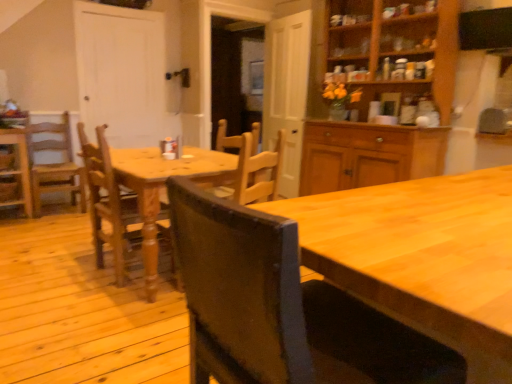
Question: Considering the relative sizes of wooden chair at center, placed as the third chair when sorted from left to right, and light brown wooden chair at left, acting as the 4th chair starting from the front, in the image provided, is wooden chair at center, placed as the third chair when sorted from left to right, thinner than light brown wooden chair at left, acting as the 4th chair starting from the front,?

Choices:
 (A) yes
 (B) no

Answer: (A)

Question: Does wooden chair at center, which ranks as the 3th chair in back-to-front order, appear on the left side of light brown wooden chair at left, arranged as the third chair when viewed from the right?

Choices:
 (A) yes
 (B) no

Answer: (B)

Question: From a real-world perspective, is wooden chair at center, which ranks as the 3th chair in back-to-front order, under light brown wooden chair at left, arranged as the third chair when viewed from the right?

Choices:
 (A) no
 (B) yes

Answer: (A)

Question: Is wooden chair at center, which appears as the second chair when viewed from the front, in front of light brown wooden chair at left, arranged as the third chair when viewed from the right?

Choices:
 (A) yes
 (B) no

Answer: (A)

Question: Is the surface of wooden chair at center, which appears as the 2th chair when viewed from the right, in direct contact with light brown wooden chair at left, acting as the 4th chair starting from the front?

Choices:
 (A) yes
 (B) no

Answer: (B)

Question: Is light brown wooden chair at left, arranged as the third chair when viewed from the right, spatially inside wooden chair at left, the fourth chair viewed from the right, or outside of it?

Choices:
 (A) inside
 (B) outside

Answer: (B)

Question: Looking at the image, does light brown wooden chair at left, placed as the second chair when sorted from left to right, seem bigger or smaller compared to wooden chair at left, the third chair in the front-to-back sequence?

Choices:
 (A) big
 (B) small

Answer: (A)

Question: In terms of width, does light brown wooden chair at left, acting as the 4th chair starting from the front, look wider or thinner when compared to wooden chair at left, the fourth chair viewed from the right?

Choices:
 (A) thin
 (B) wide

Answer: (A)

Question: Is light brown wooden chair at left, acting as the 4th chair starting from the front, to the left or to the right of wooden chair at left, which is the 2th chair in back-to-front order, in the image?

Choices:
 (A) right
 (B) left

Answer: (A)

Question: Looking at the image, does wooden chair at center, the first chair from the front, seem bigger or smaller compared to wooden chair at center, which appears as the second chair when viewed from the front?

Choices:
 (A) big
 (B) small

Answer: (B)

Question: Considering the positions of point (254, 299) and point (82, 139), is point (254, 299) closer or farther from the camera than point (82, 139)?

Choices:
 (A) closer
 (B) farther

Answer: (A)

Question: Relative to wooden chair at center, which appears as the 2th chair when viewed from the right, is wooden chair at center, the first chair when ordered from right to left, in front or behind?

Choices:
 (A) front
 (B) behind

Answer: (A)

Question: Considering the positions of wooden chair at center, the first chair from the front, and wooden chair at center, which ranks as the 3th chair in back-to-front order, in the image, is wooden chair at center, the first chair from the front, wider or thinner than wooden chair at center, which ranks as the 3th chair in back-to-front order,?

Choices:
 (A) wide
 (B) thin

Answer: (A)

Question: Is black matte exhaust hood at upper right to the left or to the right of light brown wooden chair at left, the first chair positioned from the back, in the image?

Choices:
 (A) right
 (B) left

Answer: (A)

Question: From the image's perspective, is black matte exhaust hood at upper right located above or below light brown wooden chair at left, arranged as the third chair when viewed from the right?

Choices:
 (A) below
 (B) above

Answer: (B)